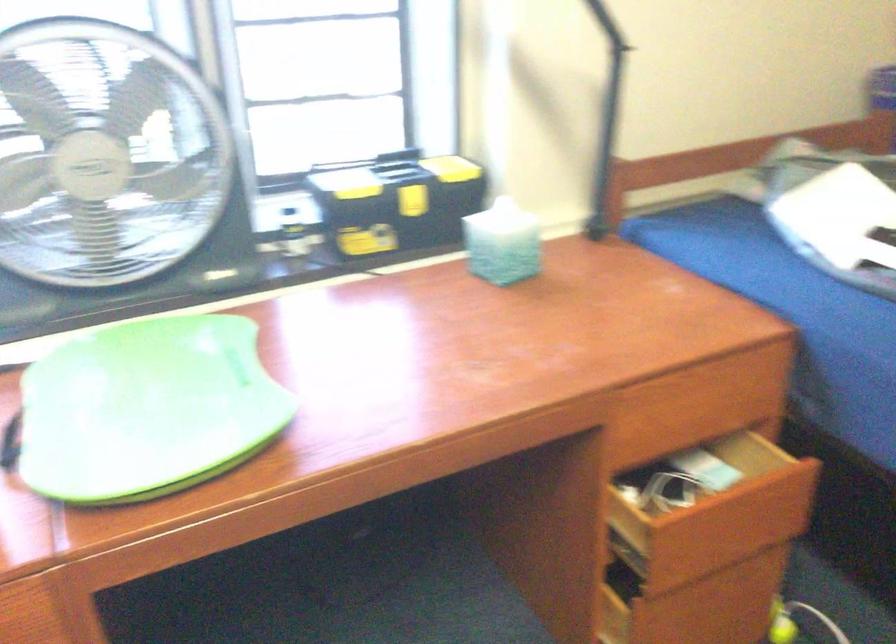
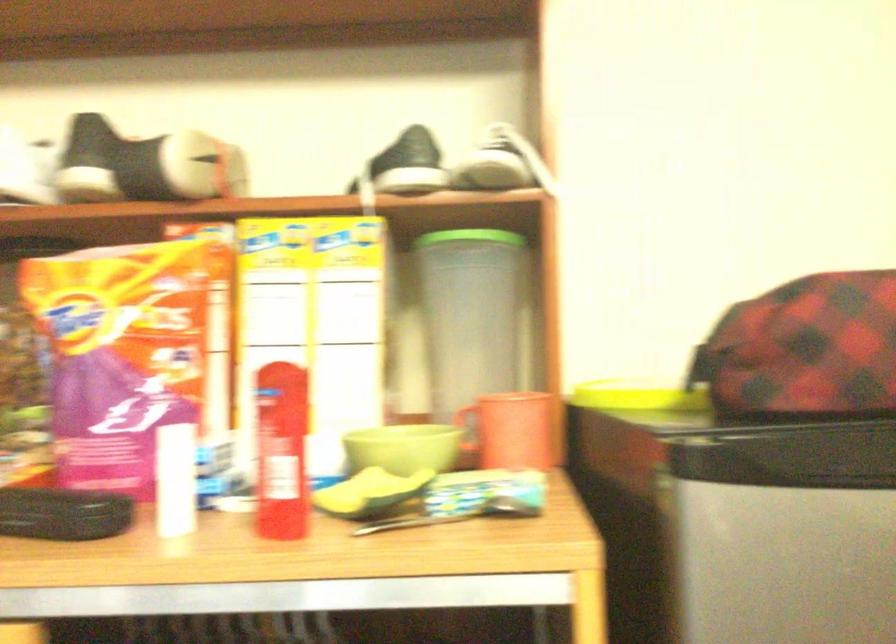
Question: The camera is either moving clockwise (left) or counter-clockwise (right) around the object. The first image is from the beginning of the video and the second image is from the end. Is the camera moving left or right when shooting the video?

Choices:
 (A) Left
 (B) Right

Answer: (A)